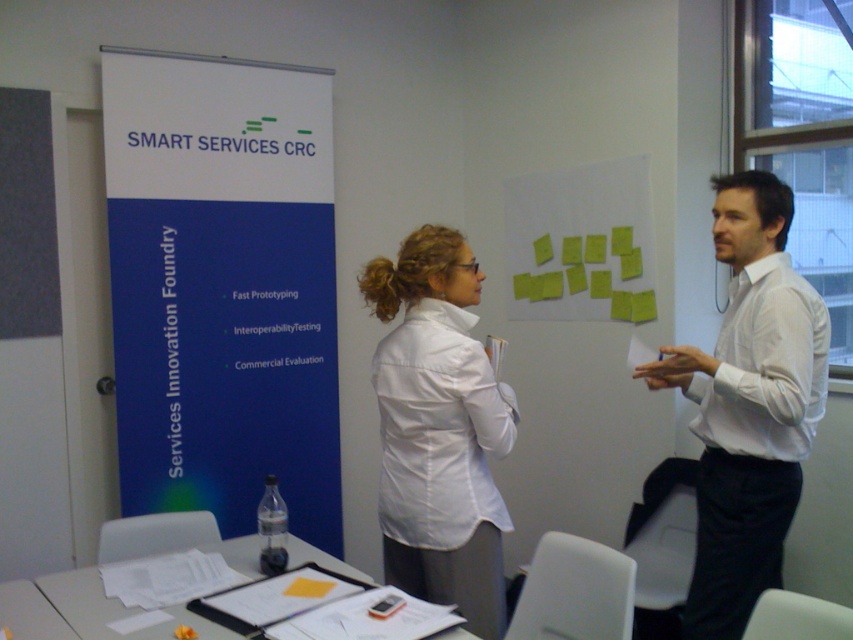
You are standing in the conference room and want to move from point A at coordinates point (146, 104) to point B at coordinates point (688, 596). Which point is closer to you when you start at point A?

Point A at coordinates point (146, 104) is closer to you since it is the starting point, while point B at coordinates point (688, 596) is further away based on their positions in the image.

You are organizing a presentation and need to place the white matte shirt at center and the yellow paper at upper center on a display board. Which object should you place first if you want to ensure both fit side by side without overlapping?

The white matte shirt at center has a smaller width than the yellow paper at upper center. Therefore, you should place the yellow paper at upper center first to accommodate its larger size, ensuring both fit side by side without overlapping.

Based on the photo, you are standing in the conference room and need to hand a document to the person wearing the white shirt at right. Based on their position at coordinates point 0.633, 0.878, can you estimate their location relative to the room entrance?

The white shirt at right is located at point [747,404], which means they are positioned towards the lower right corner of the room. Assuming the entrance is typically located near the lower left, they are likely positioned away from the entrance closer to the opposite wall.